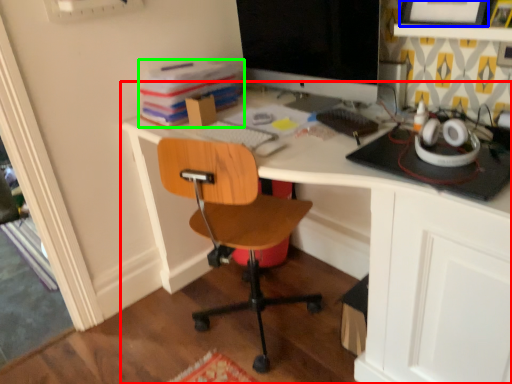
Question: Which object is positioned closest to desk (highlighted by a red box)? Select from picture frame (highlighted by a blue box) and book (highlighted by a green box).

Choices:
 (A) picture frame
 (B) book

Answer: (A)